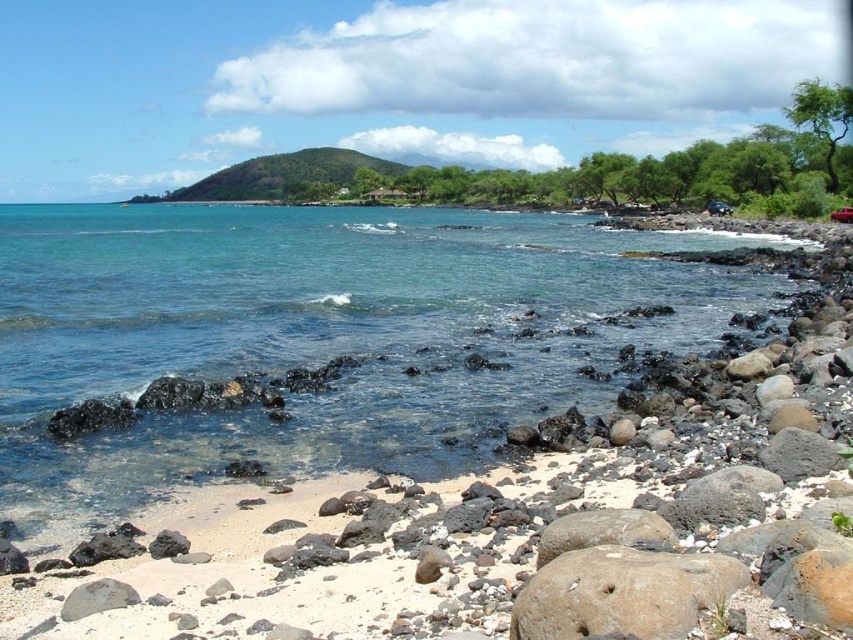
You are standing on the beach and see two points marked in the image. The first point is at coordinates point [67,456] and the second is at point [700,596]. Which point is closer to you?

Point [67,456] is closer to you because it is further to the viewer than point [700,596].

You are standing on the beach and want to walk from the brown rough rock at lower right to the clear blue water at center. Which direction should you move to reach the water without stepping on the rocks?

You should move towards the center from the brown rough rock at lower right, as the clear blue water at center is wider than the rock, providing a clear path.